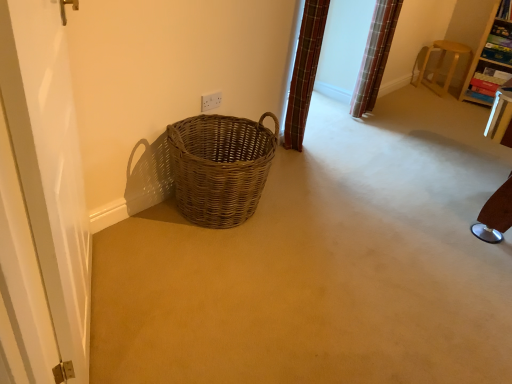
You are a GUI agent. You are given a task and a screenshot of the screen. Output one action in this format:
    pyautogui.click(x=<x>, y=<y>)
    Task: Click on the vacant space behind white glossy screen door at left
    Image resolution: width=512 pixels, height=384 pixels.
    Given the screenshot: What is the action you would take?
    pyautogui.click(x=139, y=254)